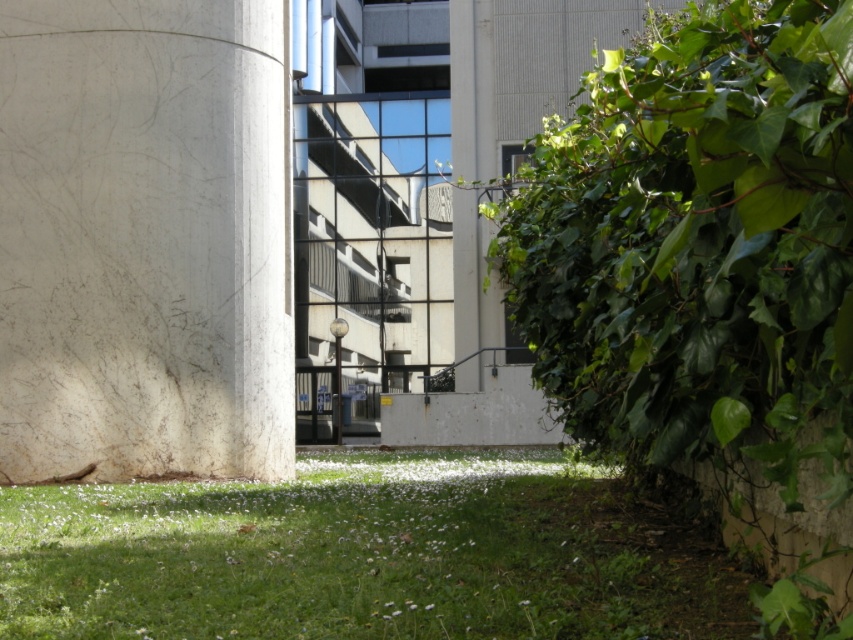
Question: Can you confirm if white marble pillar at left is smaller than white smooth pillar at center?

Choices:
 (A) no
 (B) yes

Answer: (B)

Question: Which point is closer to the camera taking this photo?

Choices:
 (A) (97, 28)
 (B) (454, 36)

Answer: (A)

Question: Does green leafy hedge at right have a smaller size compared to white marble pillar at left?

Choices:
 (A) no
 (B) yes

Answer: (A)

Question: Which is nearer to the white smooth pillar at center?

Choices:
 (A) green leafy hedge at right
 (B) white marble pillar at left

Answer: (A)

Question: Estimate the real-world distances between objects in this image. Which object is farther from the green grass at lower center?

Choices:
 (A) green leafy hedge at right
 (B) white smooth pillar at center
 (C) white marble pillar at left

Answer: (B)

Question: Can you confirm if white marble pillar at left is smaller than green grass at lower center?

Choices:
 (A) no
 (B) yes

Answer: (B)